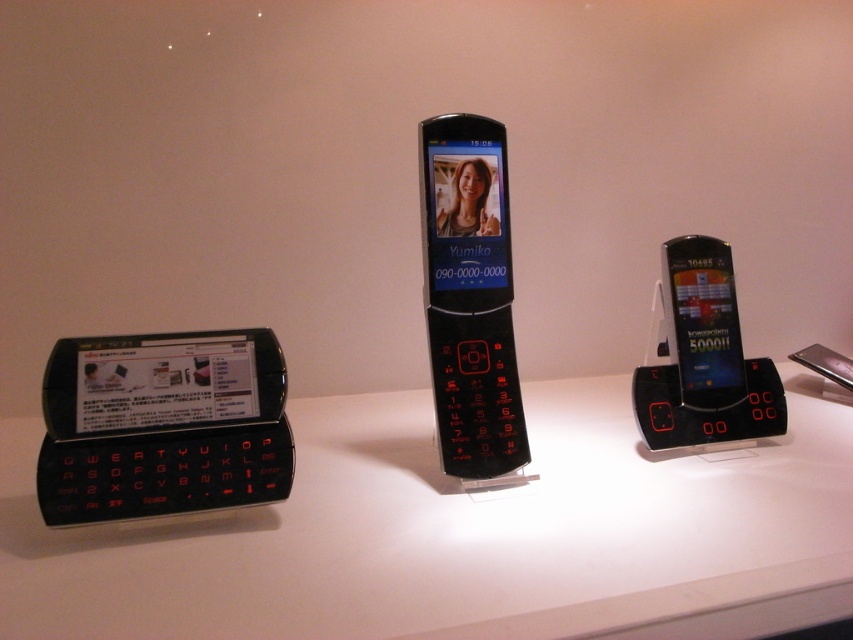
Who is more distant from viewer, (20, 490) or (132, 362)?

The point (20, 490) is behind.

Is white glossy counter top at center positioned behind black matte keyboard at left?

No, white glossy counter top at center is closer to the viewer.

Where is `white glossy counter top at center`? white glossy counter top at center is located at coordinates (457, 534).

In the scene shown: Between black matte keyboard at left and matte black smartphone at center, which one is positioned higher?

matte black smartphone at center is higher up.

Does black matte keyboard at left have a greater width compared to matte black smartphone at center?

Yes, black matte keyboard at left is wider than matte black smartphone at center.

Is point (175, 500) farther from camera compared to point (730, 349)?

No, it is in front of (730, 349).

The height and width of the screenshot is (640, 853). In order to click on black matte keyboard at left in this screenshot , I will do `click(161, 426)`.

Does white glossy counter top at center have a larger size compared to matte black smartphone at center?

Yes, white glossy counter top at center is bigger than matte black smartphone at center.

Is point (711, 593) positioned after point (694, 328)?

No.

Is point (84, 620) less distant than point (724, 387)?

That is True.

You are a GUI agent. You are given a task and a screenshot of the screen. Output one action in this format:
    pyautogui.click(x=<x>, y=<y>)
    Task: Click on the white glossy counter top at center
    
    Given the screenshot: What is the action you would take?
    pyautogui.click(x=457, y=534)